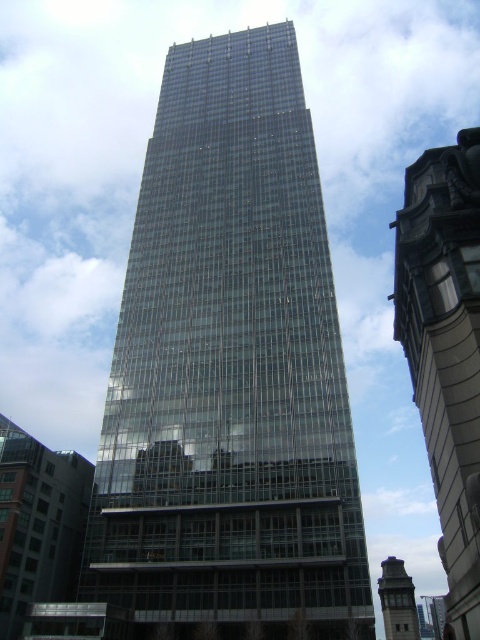
You are standing in front of the skyscraper and notice two points marked on its glass facade. The first point is at coordinates point [312,378] and the second is at point [397,563]. Which point is closer to your current position?

Point [312,378] is closer to the viewer than point [397,563].

You are standing in the middle of an urban park and see the transparent glass tower at center and the transparent glass building at center. Which one is closer to you?

The transparent glass tower at center is closer to you because it is in front of the transparent glass building at center.

You are standing in front of the skyscraper and want to determine which of the two points, point [68,508] or point [416,611], is closer to you. Based on the image, which point is nearer?

Point [68,508] is closer to the viewer than point [416,611].